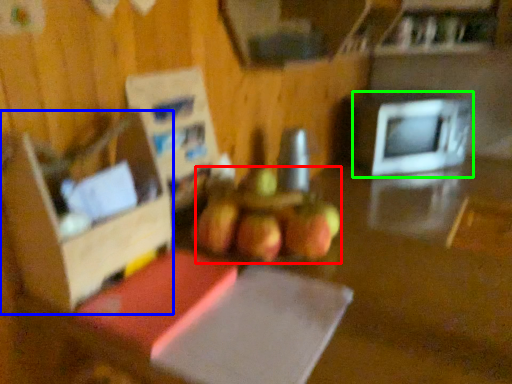
Question: Which object is the closest to the apple (highlighted by a red box)? Choose among these: box (highlighted by a blue box) or microwave oven (highlighted by a green box).

Choices:
 (A) box
 (B) microwave oven

Answer: (A)